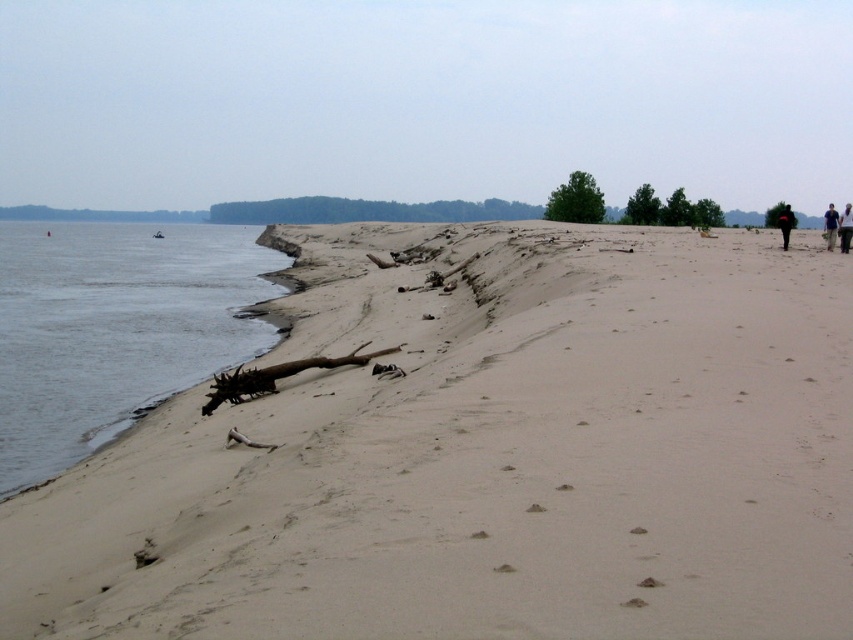
Which is above, light beige sand at center or dark blue shirt at right?

Positioned higher is dark blue shirt at right.

Is point (218, 577) in front of point (828, 220)?

Yes, it is in front of point (828, 220).

Does point (494, 282) come farther from viewer compared to point (827, 220)?

No, (494, 282) is in front of (827, 220).

You are a GUI agent. You are given a task and a screenshot of the screen. Output one action in this format:
    pyautogui.click(x=<x>, y=<y>)
    Task: Click on the light beige sand at center
    The width and height of the screenshot is (853, 640).
    Given the screenshot: What is the action you would take?
    pyautogui.click(x=485, y=454)

Is point (711, 490) positioned before point (787, 209)?

Yes, point (711, 490) is closer to viewer.

Does light beige sand at center have a greater height compared to dark brown leather jacket at right?

Incorrect, light beige sand at center's height is not larger of dark brown leather jacket at right's.

This screenshot has height=640, width=853. Identify the location of light beige sand at center. pyautogui.click(x=485, y=454).

This screenshot has height=640, width=853. Identify the location of light beige sand at center. (485, 454).

Is point (846, 204) positioned behind point (787, 248)?

That is True.

How far apart are dark blue jeans at right and dark brown leather jacket at right?

40.36 meters

Is point (845, 241) in front of point (782, 212)?

Yes, it is in front of point (782, 212).

Identify the location of dark blue jeans at right. (845, 228).